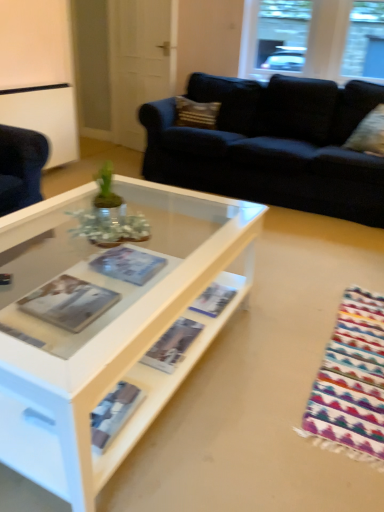
Measure the distance between point (207, 109) and camera.

They are 11.52 feet apart.

How much space does matte paper magazine at center, arranged as the 1th magazine when viewed from the left, occupy vertically?

1.52 inches.

Identify the location of matte paper magazine at center, the second magazine positioned from the right. The image size is (384, 512). (128, 265).

The height and width of the screenshot is (512, 384). In order to click on white glossy coffee table at center in this screenshot , I will do `click(103, 324)`.

Find the location of a particular element. The image size is (384, 512). matte paper magazine at center, which is the 3th magazine from left to right is located at coordinates (213, 300).

In the scene shown: Is matte paper magazine at center, the 2th magazine when ordered from left to right, inside the boundaries of velvet beige pillow at upper right, the first pillow from the bottom, or outside?

The correct answer is: outside.

Is matte paper magazine at center, the second magazine positioned from the right, thinner than velvet beige pillow at upper right, marked as the first pillow in a right-to-left arrangement?

Yes.

Where is `the 1st pillow behind the matte paper magazine at center, the second magazine positioned from the right`? the 1st pillow behind the matte paper magazine at center, the second magazine positioned from the right is located at coordinates (369, 134).

Considering the sizes of objects matte paper magazine at center, the first magazine positioned from the right, and clear glass window at upper center in the image provided, who is shorter, matte paper magazine at center, the first magazine positioned from the right, or clear glass window at upper center?

matte paper magazine at center, the first magazine positioned from the right, is shorter.

From the clear glass window at upper center, count 2nd magazines forward and point to it. Please provide its 2D coordinates.

[(213, 300)]

In the scene shown: Do you think matte paper magazine at center, the first magazine positioned from the right, is within clear glass window at upper center, or outside of it?

The correct answer is: outside.

From the image's perspective, is matte paper magazine at center, which is the 3th magazine from left to right, under clear glass window at upper center?

Indeed, from the image's perspective, matte paper magazine at center, which is the 3th magazine from left to right, is shown beneath clear glass window at upper center.

Considering the relative sizes of clear glass window at upper center and white glossy door at upper center in the image provided, is clear glass window at upper center shorter than white glossy door at upper center?

Yes, clear glass window at upper center is shorter than white glossy door at upper center.

Is clear glass window at upper center far from white glossy door at upper center?

Yes.

From a real-world perspective, is clear glass window at upper center above or below white glossy door at upper center?

Clearly, from a real-world perspective, clear glass window at upper center is above white glossy door at upper center.

Which point is more distant from viewer, (361, 12) or (115, 73)?

The point (115, 73) is behind.

Which object is further away from the camera, matte paper magazine at center, the first magazine positioned from the right, or velvet beige pillow at upper right, the first pillow from the bottom?

velvet beige pillow at upper right, the first pillow from the bottom, is behind.

Is matte paper magazine at center, the first magazine positioned from the right, aimed at velvet beige pillow at upper right, the first pillow from the bottom?

No, matte paper magazine at center, the first magazine positioned from the right, is not aimed at velvet beige pillow at upper right, the first pillow from the bottom.

Measure the distance from matte paper magazine at center, which is the 3th magazine from left to right, to velvet beige pillow at upper right, marked as the first pillow in a right-to-left arrangement.

matte paper magazine at center, which is the 3th magazine from left to right, and velvet beige pillow at upper right, marked as the first pillow in a right-to-left arrangement, are 6.52 feet apart.

From the image's perspective, starting from the velvet beige pillow at upper right, placed as the second pillow when sorted from top to bottom, which magazine is the 2nd one below? Please provide its 2D coordinates.

[(213, 300)]

Which is more to the left, velvet beige pillow at upper right, marked as the first pillow in a right-to-left arrangement, or white glossy coffee table at center?

white glossy coffee table at center is more to the left.

Is velvet beige pillow at upper right, placed as the second pillow when sorted from top to bottom, behind white glossy coffee table at center?

Yes, velvet beige pillow at upper right, placed as the second pillow when sorted from top to bottom, is further from the viewer.

Considering the sizes of velvet beige pillow at upper right, the second pillow from the back, and white glossy coffee table at center in the image, is velvet beige pillow at upper right, the second pillow from the back, bigger or smaller than white glossy coffee table at center?

Considering their sizes, velvet beige pillow at upper right, the second pillow from the back, takes up less space than white glossy coffee table at center.

Is velvet beige pillow at upper right, placed as the second pillow when sorted from top to bottom, facing away from white glossy coffee table at center?

No, velvet beige pillow at upper right, placed as the second pillow when sorted from top to bottom, is not facing away from white glossy coffee table at center.

From the image's perspective, does matte paper magazine at center, arranged as the 1th magazine when viewed from the left, appear higher than white glossy coffee table at center?

No, from the image's perspective, matte paper magazine at center, arranged as the 1th magazine when viewed from the left, is not on top of white glossy coffee table at center.

Which object is closer to the camera taking this photo, matte paper magazine at center, the 3th magazine when ordered from right to left, or white glossy coffee table at center?

Positioned in front is white glossy coffee table at center.

Is point (41, 312) behind point (72, 476)?

Yes, point (41, 312) is behind point (72, 476).

In the image, is matte paper magazine at center, the 2th magazine when ordered from left to right, on the left side or the right side of white glossy door at upper center?

matte paper magazine at center, the 2th magazine when ordered from left to right, is to the right of white glossy door at upper center.

Is matte paper magazine at center, the 2th magazine when ordered from left to right, inside or outside of white glossy door at upper center?

matte paper magazine at center, the 2th magazine when ordered from left to right, lies outside white glossy door at upper center.

Is white glossy door at upper center at the back of matte paper magazine at center, the second magazine positioned from the right?

That's not correct — matte paper magazine at center, the second magazine positioned from the right, is not looking away from white glossy door at upper center.

Considering the relative sizes of matte paper magazine at center, the second magazine positioned from the right, and white glossy door at upper center in the image provided, is matte paper magazine at center, the second magazine positioned from the right, bigger than white glossy door at upper center?

Incorrect, matte paper magazine at center, the second magazine positioned from the right, is not larger than white glossy door at upper center.

From a real-world perspective, count 2nd pillows upward from the matte paper magazine at center, the second magazine positioned from the right, and point to it. Please provide its 2D coordinates.

[(369, 134)]

Image resolution: width=384 pixels, height=512 pixels. Find the location of `window behind the matte paper magazine at center, which is the 3th magazine from left to right`. window behind the matte paper magazine at center, which is the 3th magazine from left to right is located at coordinates (307, 38).

Based on the photo, when comparing their distances from matte paper magazine at center, the 2th magazine when ordered from left to right, does velvet beige pillow at upper right, the first pillow from the bottom, or clear glass window at upper center seem closer?

velvet beige pillow at upper right, the first pillow from the bottom.

Based on their spatial positions, is velvet beige pillow at upper right, which is the 1th pillow in front-to-back order, or clear glass window at upper center further from white glossy coffee table at center?

clear glass window at upper center is positioned further to the anchor white glossy coffee table at center.

Estimate the real-world distances between objects in this image. Which object is closer to matte paper magazine at center, arranged as the 1th magazine when viewed from the left, clear glass window at upper center or textured beige pillow at upper center, positioned as the 1th pillow in top-to-bottom order?

Based on the image, textured beige pillow at upper center, positioned as the 1th pillow in top-to-bottom order, appears to be nearer to matte paper magazine at center, arranged as the 1th magazine when viewed from the left.

Consider the image. From the image, which object appears to be nearer to matte paper magazine at center, the second magazine positioned from the right, matte paper magazine at center, the 3th magazine when ordered from right to left, or textured beige pillow at upper center, the first pillow when ordered from back to front?

matte paper magazine at center, the 3th magazine when ordered from right to left, lies closer to matte paper magazine at center, the second magazine positioned from the right, than the other object.

Considering their positions, is clear glass window at upper center positioned further to textured beige pillow at upper center, arranged as the second pillow when viewed from the front, than white glossy coffee table at center?

Among the two, white glossy coffee table at center is located further to textured beige pillow at upper center, arranged as the second pillow when viewed from the front.

Looking at the image, which one is located closer to matte paper magazine at center, which is the 3th magazine from left to right, white glossy door at upper center or white glossy coffee table at center?

The object closer to matte paper magazine at center, which is the 3th magazine from left to right, is white glossy coffee table at center.

Which object lies further to the anchor point matte paper magazine at center, which is the 3th magazine from left to right, clear glass window at upper center or white glossy coffee table at center?

clear glass window at upper center lies further to matte paper magazine at center, which is the 3th magazine from left to right, than the other object.

Which object lies nearer to the anchor point white glossy door at upper center, white glossy coffee table at center or matte paper magazine at center, the 3th magazine when ordered from right to left?

Based on the image, white glossy coffee table at center appears to be nearer to white glossy door at upper center.

Identify the location of magazine between matte paper magazine at center, which is the 3th magazine from left to right, and textured beige pillow at upper center, the first pillow positioned from the left, from front to back. The width and height of the screenshot is (384, 512). (128, 265).

The image size is (384, 512). Identify the location of pillow between white glossy coffee table at center and clear glass window at upper center in the front-back direction. (369, 134).

I want to click on pillow between matte paper magazine at center, the second magazine positioned from the right, and velvet beige pillow at upper right, marked as the first pillow in a right-to-left arrangement, in the horizontal direction, so click(196, 113).

Locate an element on the screen. The image size is (384, 512). pillow between white glossy door at upper center and clear glass window at upper center in the horizontal direction is located at coordinates (196, 113).